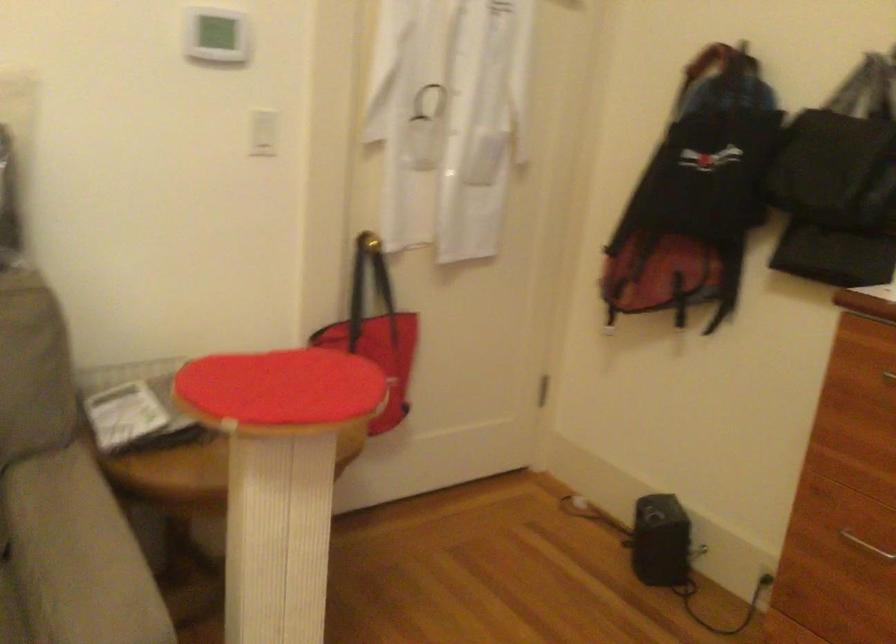
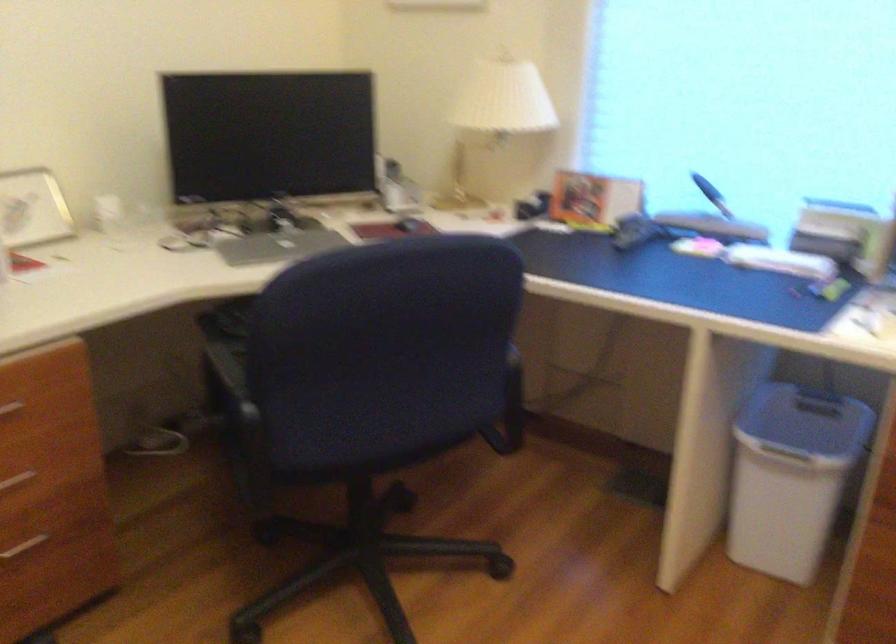
Based on the continuous images, in which direction is the camera rotating?

The camera's rotation is toward right-down.